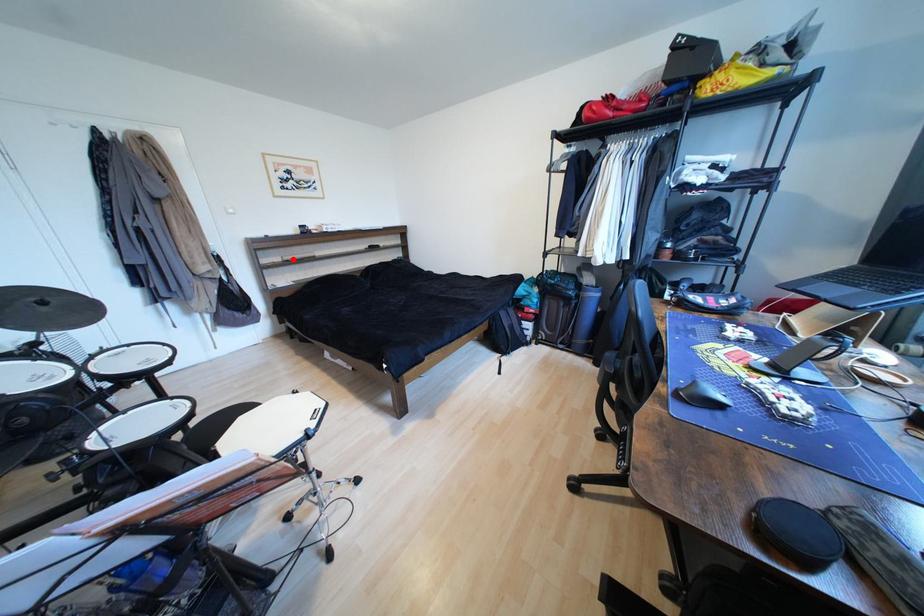
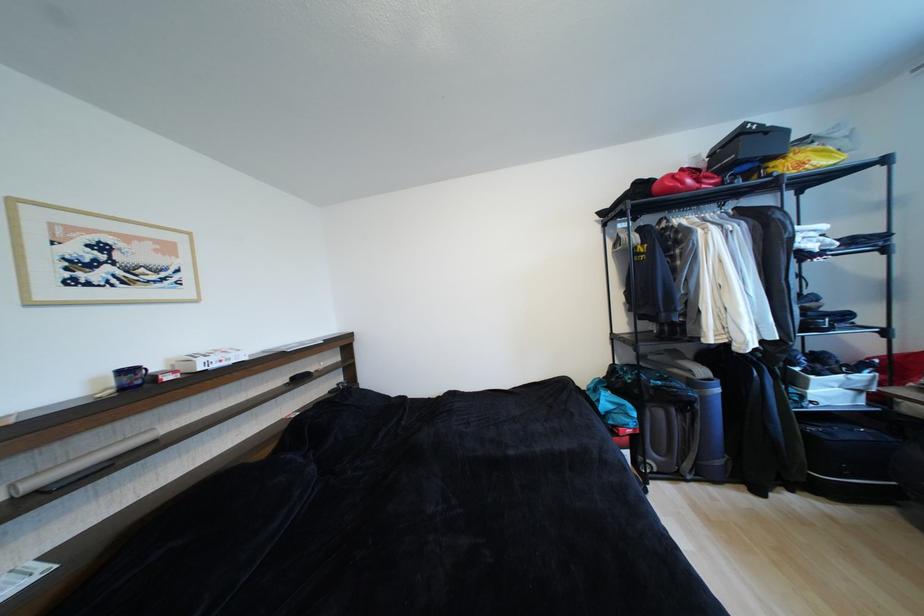
Locate, in the second image, the point that corresponds to the highlighted location in the first image.

(40, 485)